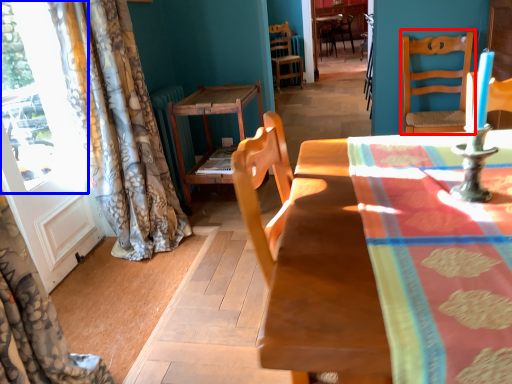
Question: Which of the following is the closest to the observer, chair (highlighted by a red box) or window (highlighted by a blue box)?

Choices:
 (A) chair
 (B) window

Answer: (B)